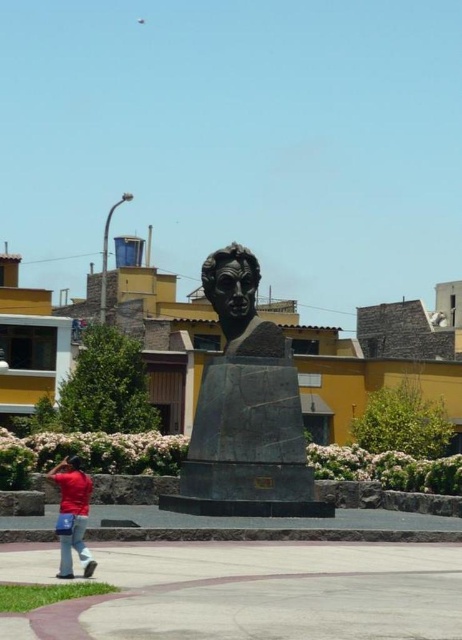
Who is lower down, black polished stone bust at center or matte red shirt at lower left?

matte red shirt at lower left

Is black polished stone bust at center closer to camera compared to matte red shirt at lower left?

No, black polished stone bust at center is further to the viewer.

Is point (224, 323) positioned behind point (84, 497)?

Yes.

At what (x,y) coordinates should I click in order to perform the action: click on black polished stone bust at center. Please return your answer as a coordinate pair (x, y). The image size is (462, 640). Looking at the image, I should click on (238, 301).

Between bronze bust at center and black polished stone bust at center, which one has more height?

With more height is bronze bust at center.

This screenshot has width=462, height=640. What do you see at coordinates (245, 410) in the screenshot? I see `bronze bust at center` at bounding box center [245, 410].

Identify the location of bronze bust at center. The height and width of the screenshot is (640, 462). click(245, 410).

Consider the image. Between bronze bust at center and matte red shirt at lower left, which one is positioned higher?

bronze bust at center is higher up.

Who is more forward, (206, 420) or (65, 461)?

Point (206, 420) is more forward.

Who is more forward, [220,266] or [62,538]?

Point [62,538] is more forward.

At what (x,y) coordinates should I click in order to perform the action: click on bronze bust at center. Please return your answer as a coordinate pair (x, y). The height and width of the screenshot is (640, 462). Looking at the image, I should click on point(245,410).